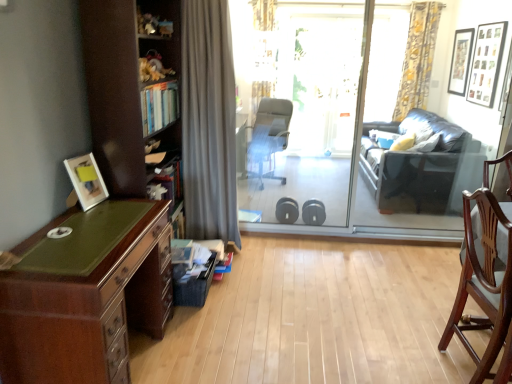
What is the approximate height of yellow floral fabric curtain at upper right, which ranks as the 2th curtain in front-to-back order?

yellow floral fabric curtain at upper right, which ranks as the 2th curtain in front-to-back order, is 5.17 feet in height.

I want to click on transparent glass screen door at center, so click(303, 105).

Where is `mahogany wood desk at left`? mahogany wood desk at left is located at coordinates (85, 294).

Relative to transparent glass door at center, is yellow floral fabric curtain at upper right, positioned as the 1th curtain in top-to-bottom order, in front or behind?

In the image, yellow floral fabric curtain at upper right, positioned as the 1th curtain in top-to-bottom order, appears behind transparent glass door at center.

Does point (399, 96) come closer to viewer compared to point (373, 166)?

No, it is behind (373, 166).

Between yellow floral fabric curtain at upper right, marked as the 2th curtain in a left-to-right arrangement, and transparent glass door at center, which one has smaller width?

Thinner between the two is yellow floral fabric curtain at upper right, marked as the 2th curtain in a left-to-right arrangement.

Is mahogany wood chair at right, positioned as the second chair in back-to-front order, positioned beyond the bounds of black matte picture frame at upper right, the 1th picture frame in the top-to-bottom sequence?

mahogany wood chair at right, positioned as the second chair in back-to-front order, is positioned outside black matte picture frame at upper right, the 1th picture frame in the top-to-bottom sequence.

How different are the orientations of mahogany wood chair at right, the 2th chair when ordered from left to right, and black matte picture frame at upper right, the third picture frame from the bottom, in degrees?

178 degrees.

Based on the photo, is mahogany wood chair at right, placed as the 1th chair when sorted from bottom to top, placed right next to black matte picture frame at upper right, which is counted as the 3th picture frame, starting from the front?

No, mahogany wood chair at right, placed as the 1th chair when sorted from bottom to top, is not with black matte picture frame at upper right, which is counted as the 3th picture frame, starting from the front.

How different are the orientations of mahogany wood desk at left and black matte picture frame at upper right, arranged as the 1th picture frame when viewed from the back, in degrees?

179 degrees.

Considering the positions of objects mahogany wood desk at left and black matte picture frame at upper right, the third picture frame from the bottom, in the image provided, who is more to the right, mahogany wood desk at left or black matte picture frame at upper right, the third picture frame from the bottom,?

Positioned to the right is black matte picture frame at upper right, the third picture frame from the bottom.

Which of these two, mahogany wood desk at left or black matte picture frame at upper right, which is the first picture frame from right to left, stands taller?

black matte picture frame at upper right, which is the first picture frame from right to left.

Is mahogany wood desk at left bigger than black matte picture frame at upper right, arranged as the 1th picture frame when viewed from the back?

Yes.

Is point (270, 143) closer to camera compared to point (82, 194)?

No, (270, 143) is further to viewer.

Can you confirm if gray fabric office chair at center, which is the first chair in left-to-right order, is positioned to the left of white glossy picture frame at left, arranged as the first picture frame when viewed from the front?

In fact, gray fabric office chair at center, which is the first chair in left-to-right order, is to the right of white glossy picture frame at left, arranged as the first picture frame when viewed from the front.

Consider the image. Would you consider gray fabric office chair at center, which ranks as the first chair in back-to-front order, to be distant from white glossy picture frame at left, arranged as the first picture frame when viewed from the front?

Absolutely, gray fabric office chair at center, which ranks as the first chair in back-to-front order, is distant from white glossy picture frame at left, arranged as the first picture frame when viewed from the front.

Is gray fabric office chair at center, which is counted as the second chair, starting from the bottom, thinner than white glossy picture frame at left, the first picture frame positioned from the left?

No, gray fabric office chair at center, which is counted as the second chair, starting from the bottom, is not thinner than white glossy picture frame at left, the first picture frame positioned from the left.

Between point (468, 257) and point (110, 145), which one is positioned behind?

The point (110, 145) is behind.

Which of these two, mahogany wood chair at right, placed as the 1th chair when sorted from bottom to top, or wooden bookshelf at left, is thinner?

Thinner between the two is wooden bookshelf at left.

From their relative heights in the image, would you say mahogany wood chair at right, placed as the 1th chair when sorted from bottom to top, is taller or shorter than wooden bookshelf at left?

In the image, mahogany wood chair at right, placed as the 1th chair when sorted from bottom to top, appears to be shorter than wooden bookshelf at left.

Considering the sizes of mahogany wood desk at left and wooden bookshelf at left in the image, is mahogany wood desk at left wider or thinner than wooden bookshelf at left?

Considering their sizes, mahogany wood desk at left looks broader than wooden bookshelf at left.

Which object is positioned more to the left, mahogany wood desk at left or wooden bookshelf at left?

mahogany wood desk at left.

Where is `bookshelf behind the mahogany wood desk at left`? The width and height of the screenshot is (512, 384). bookshelf behind the mahogany wood desk at left is located at coordinates (121, 85).

Is point (42, 315) closer or farther from the camera than point (125, 106)?

Clearly, point (42, 315) is closer to the camera than point (125, 106).

From a real-world perspective, is white glossy picture frame at left, marked as the first picture frame in a bottom-to-top arrangement, beneath black matte picture frame at upper right, the 1th picture frame in the top-to-bottom sequence?

Correct, in the physical world, white glossy picture frame at left, marked as the first picture frame in a bottom-to-top arrangement, is lower than black matte picture frame at upper right, the 1th picture frame in the top-to-bottom sequence.

The image size is (512, 384). What are the coordinates of `the 2nd picture frame behind the white glossy picture frame at left, marked as the third picture frame in a top-to-bottom arrangement, starting your count from the anchor` in the screenshot? It's located at (460, 61).

Are white glossy picture frame at left, which is the 3th picture frame in right-to-left order, and black matte picture frame at upper right, marked as the third picture frame in a left-to-right arrangement, located far from each other?

Absolutely, white glossy picture frame at left, which is the 3th picture frame in right-to-left order, is distant from black matte picture frame at upper right, marked as the third picture frame in a left-to-right arrangement.

This screenshot has width=512, height=384. Identify the location of glass door that appears below the yellow floral fabric curtain at upper right, marked as the 2th curtain in a left-to-right arrangement (from a real-world perspective). point(358,115).

At what (x,y) coordinates should I click in order to perform the action: click on the 3rd picture frame behind the mahogany wood chair at right, the first chair viewed from the front, starting your count from the anchor. Please return your answer as a coordinate pair (x, y). Image resolution: width=512 pixels, height=384 pixels. Looking at the image, I should click on (460, 61).

Looking at the image, which one is located closer to transparent glass screen door at center, gray fabric curtain at center, the second curtain when ordered from right to left, or mahogany wood desk at left?

gray fabric curtain at center, the second curtain when ordered from right to left, is closer to transparent glass screen door at center.

Based on the photo, estimate the real-world distances between objects in this image. Which object is closer to mahogany wood chair at right, the 1th chair in the right-to-left sequence, gray fabric curtain at center, the second curtain positioned from the top, or transparent glass screen door at center?

gray fabric curtain at center, the second curtain positioned from the top, is closer to mahogany wood chair at right, the 1th chair in the right-to-left sequence.

Estimate the real-world distances between objects in this image. Which object is further from yellow floral fabric curtain at upper right, which is the 2th curtain from bottom to top, black matte picture frame at upper right, arranged as the 1th picture frame when viewed from the back, or transparent glass screen door at center?

transparent glass screen door at center is further to yellow floral fabric curtain at upper right, which is the 2th curtain from bottom to top.

Consider the image. Considering their positions, is dark blue leather couch at right positioned further to transparent glass door at center than yellow floral fabric curtain at upper right, the first curtain in the back-to-front sequence?

The object further to transparent glass door at center is yellow floral fabric curtain at upper right, the first curtain in the back-to-front sequence.

When comparing their distances from yellow floral fabric curtain at upper right, which is the 2th curtain from bottom to top, does dark blue leather couch at right or mahogany wood chair at right, acting as the 2th chair starting from the top, seem closer?

Based on the image, dark blue leather couch at right appears to be nearer to yellow floral fabric curtain at upper right, which is the 2th curtain from bottom to top.

Looking at the image, which one is located closer to wooden picture frame at upper right, placed as the second picture frame when sorted from back to front, black matte picture frame at upper right, the 1th picture frame in the top-to-bottom sequence, or yellow floral fabric curtain at upper right, the first curtain in the back-to-front sequence?

Among the two, black matte picture frame at upper right, the 1th picture frame in the top-to-bottom sequence, is located nearer to wooden picture frame at upper right, placed as the second picture frame when sorted from back to front.

Estimate the real-world distances between objects in this image. Which object is further from mahogany wood chair at right, positioned as the second chair in back-to-front order, dark blue leather couch at right or transparent glass door at center?

transparent glass door at center is positioned further to the anchor mahogany wood chair at right, positioned as the second chair in back-to-front order.

Based on their spatial positions, is transparent glass screen door at center or transparent glass door at center closer to wooden bookshelf at left?

The object closer to wooden bookshelf at left is transparent glass screen door at center.

The height and width of the screenshot is (384, 512). What are the coordinates of `glass door located between wooden bookshelf at left and black matte picture frame at upper right, the 1th picture frame in the top-to-bottom sequence, in the left-right direction` in the screenshot? It's located at (358, 115).

Where is `picture frame between wooden bookshelf at left and black matte picture frame at upper right, the third picture frame from the bottom, in the horizontal direction`? The width and height of the screenshot is (512, 384). picture frame between wooden bookshelf at left and black matte picture frame at upper right, the third picture frame from the bottom, in the horizontal direction is located at coordinates (486, 63).

The height and width of the screenshot is (384, 512). What are the coordinates of `bookshelf between white glossy picture frame at left, arranged as the first picture frame when viewed from the front, and dark blue leather couch at right from left to right` in the screenshot? It's located at (121, 85).

Where is `screen door between white glossy picture frame at left, which ranks as the 3th picture frame in back-to-front order, and dark blue leather couch at right`? This screenshot has width=512, height=384. screen door between white glossy picture frame at left, which ranks as the 3th picture frame in back-to-front order, and dark blue leather couch at right is located at coordinates (303, 105).